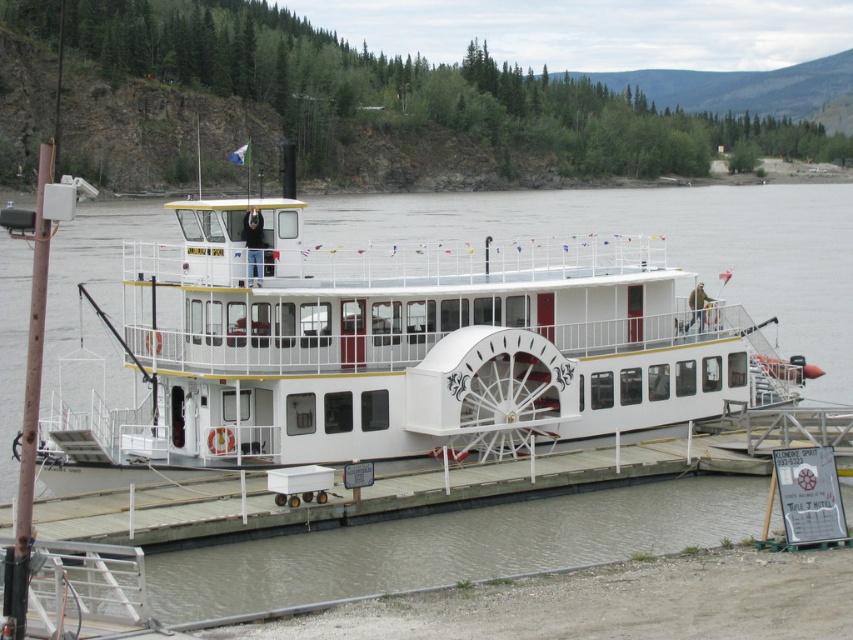
You are standing on the white wooden dock at center and want to take a photo of the white matte paddlewheel boat at center. Which direction should you face to ensure the boat is fully visible in your photo?

Since the white matte paddlewheel boat at center is in front of the white wooden dock at center, you should face away from the boat to ensure the boat is fully visible in your photo.

You are standing on the wooden pier and see the point marked at coordinates (399, 353). What object is located at that point?

The point at coordinates (399, 353) indicates the white matte paddlewheel boat at center.